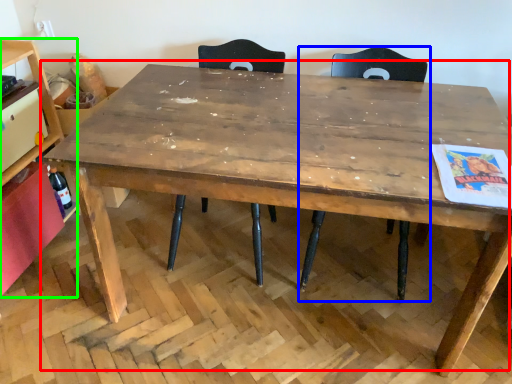
Question: Which object is positioned farthest from table (highlighted by a red box)? Select from chair (highlighted by a blue box) and shelf (highlighted by a green box).

Choices:
 (A) chair
 (B) shelf

Answer: (B)